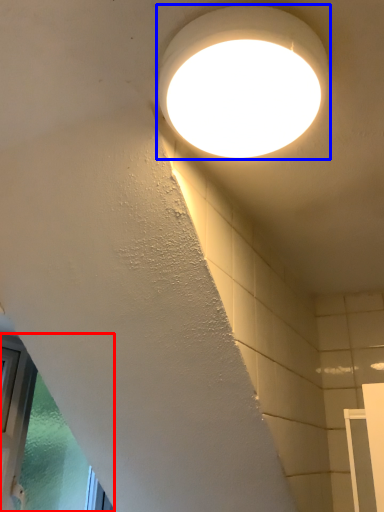
Question: Which object appears closest to the camera in this image, window (highlighted by a red box) or lamp (highlighted by a blue box)?

Choices:
 (A) window
 (B) lamp

Answer: (B)